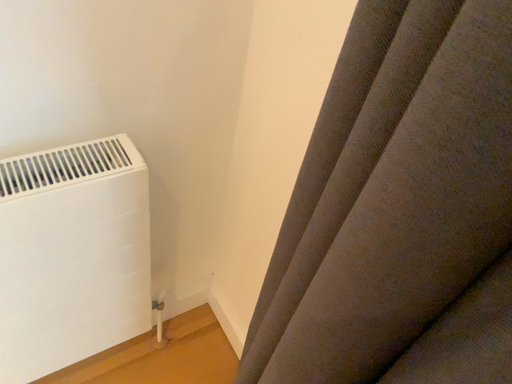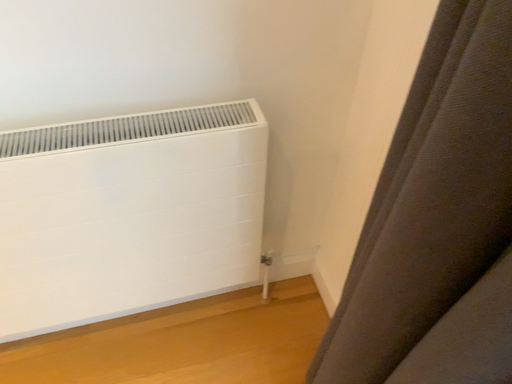
Question: Which way did the camera rotate in the video?

Choices:
 (A) rotated left
 (B) rotated right

Answer: (A)